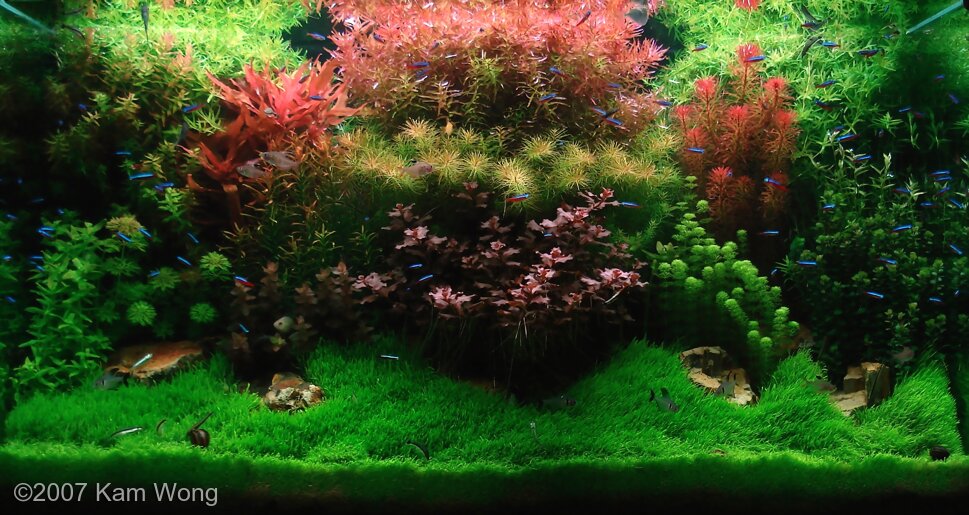
Locate an element on the screen. This screenshot has height=515, width=969. light area is located at coordinates click(x=261, y=42).